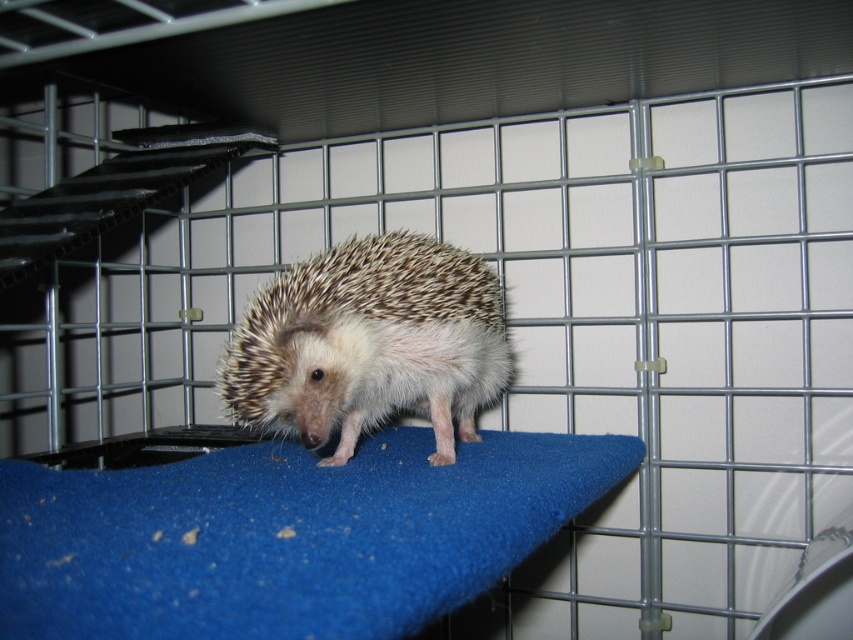
You are a small toy that is 10 cm wide. You want to place yourself on the blue felt mat at center without touching the brown spiny hedgehog at center. Is there enough space?

The blue felt mat at center is wider than the brown spiny hedgehog at center, so there is enough space to place the toy on the blue felt mat at center without touching the hedgehog.

Based on the photo, you are a small toy that needs to be placed inside the cage with the hedgehog. The cage has limited space. Considering the blue felt mat at center and the brown spiny hedgehog at center, which object takes up more space in the cage?

The brown spiny hedgehog at center takes up more space than the blue felt mat at center in the cage.